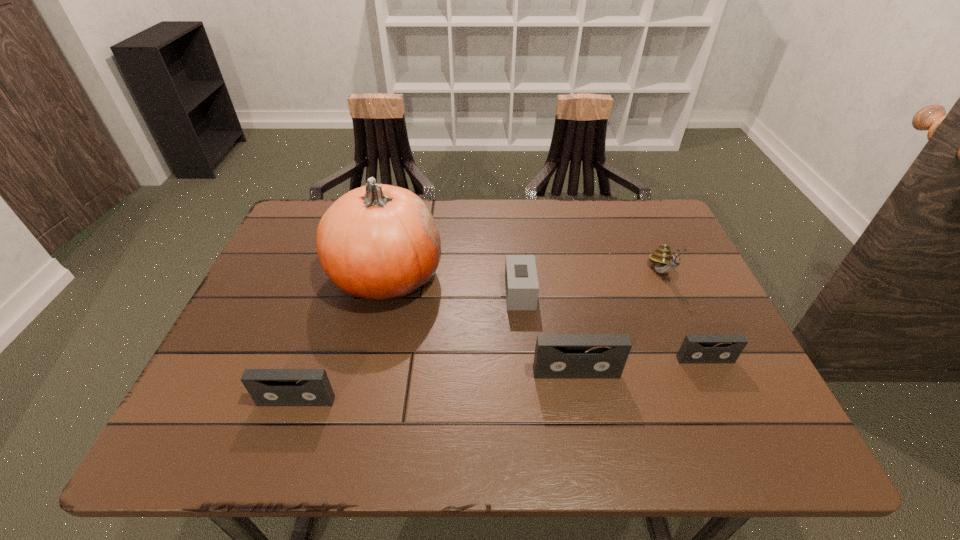
Where is `empty space that is in between the snail and the second shortest videotape`? This screenshot has height=540, width=960. empty space that is in between the snail and the second shortest videotape is located at coordinates (479, 336).

This screenshot has height=540, width=960. I want to click on free spot between the second videotape from left to right and the tallest object, so click(x=481, y=324).

You are a GUI agent. You are given a task and a screenshot of the screen. Output one action in this format:
    pyautogui.click(x=<x>, y=<y>)
    Task: Click on the vacant space that is in between the farthest videotape and the second farthest videotape
    Image resolution: width=960 pixels, height=540 pixels.
    Given the screenshot: What is the action you would take?
    pyautogui.click(x=640, y=367)

Find the location of a particular element. The image size is (960, 540). empty space that is in between the leftmost videotape and the second nearest object is located at coordinates (436, 387).

Locate an element on the screen. Image resolution: width=960 pixels, height=540 pixels. free spot between the tallest object and the second nearest object is located at coordinates (481, 324).

Locate an element on the screen. The height and width of the screenshot is (540, 960). object identified as the fourth closest to the second videotape from right to left is located at coordinates (664, 261).

Locate which object ranks fifth in proximity to the snail. Please provide its 2D coordinates. Your answer should be formatted as a tuple, i.e. [(x, y)], where the tuple contains the x and y coordinates of a point satisfying the conditions above.

[(267, 387)]

Select which videotape appears as the third closest to the pumpkin. Please provide its 2D coordinates. Your answer should be formatted as a tuple, i.e. [(x, y)], where the tuple contains the x and y coordinates of a point satisfying the conditions above.

[(695, 348)]

Locate which videotape is the second closest to the snail. Please provide its 2D coordinates. Your answer should be formatted as a tuple, i.e. [(x, y)], where the tuple contains the x and y coordinates of a point satisfying the conditions above.

[(557, 356)]

Identify the location of free space that satisfies the following two spatial constraints: 1. on the front-facing side of the alarm clock; 2. on the front-facing side of the leftmost videotape. (531, 401).